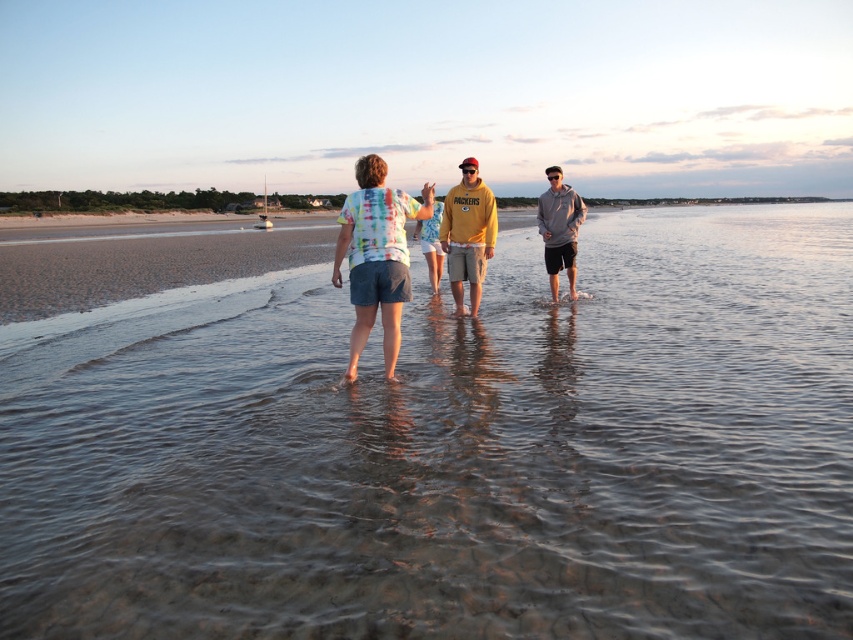
Which is in front, point (241, 508) or point (556, 205)?

Positioned in front is point (241, 508).

Describe the element at coordinates (453, 451) in the screenshot. I see `clear water at center` at that location.

Measure the distance between point (155, 483) and camera.

4.27 meters

The image size is (853, 640). I want to click on clear water at center, so click(x=453, y=451).

Does clear water at center have a greater width compared to tie-dye fabric shirt at center?

Indeed, clear water at center has a greater width compared to tie-dye fabric shirt at center.

Between clear water at center and tie-dye fabric shirt at center, which one has less height?

tie-dye fabric shirt at center

The width and height of the screenshot is (853, 640). I want to click on clear water at center, so click(x=453, y=451).

Find the location of `clear water at center`. clear water at center is located at coordinates (453, 451).

Is yellow fleece at center to the right of gray hoodie at center from the viewer's perspective?

No, yellow fleece at center is not to the right of gray hoodie at center.

Is yellow fleece at center taller than gray hoodie at center?

In fact, yellow fleece at center may be shorter than gray hoodie at center.

Is point (456, 301) farther from camera compared to point (548, 253)?

No, (456, 301) is in front of (548, 253).

You are a GUI agent. You are given a task and a screenshot of the screen. Output one action in this format:
    pyautogui.click(x=<x>, y=<y>)
    Task: Click on the yellow fleece at center
    
    Given the screenshot: What is the action you would take?
    pyautogui.click(x=468, y=234)